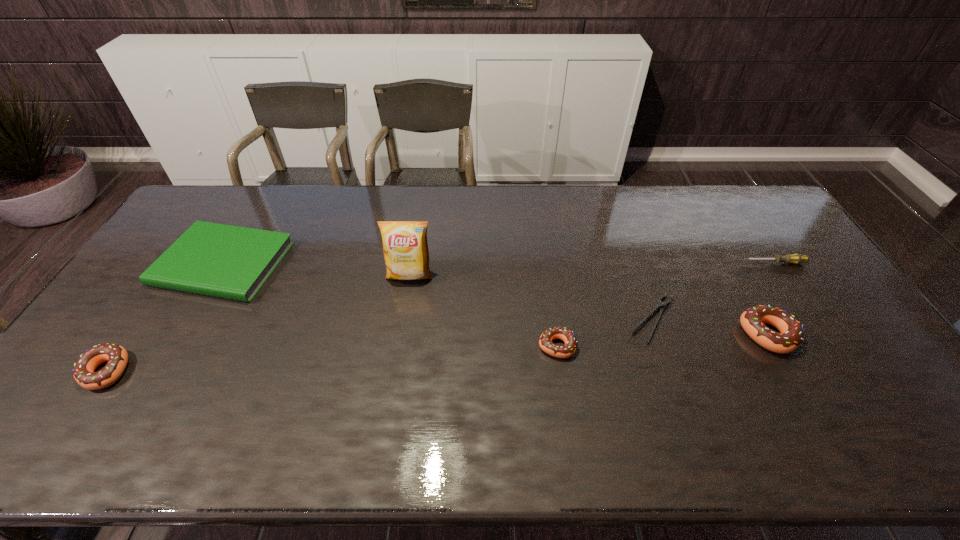
Locate an element on the screen. The height and width of the screenshot is (540, 960). vacant space located 0.240m on the front-facing side of the third object from left to right is located at coordinates (397, 353).

The image size is (960, 540). What are the coordinates of `object that is at the near edge` in the screenshot? It's located at pos(83,371).

Locate an element on the screen. Image resolution: width=960 pixels, height=540 pixels. doughnut that is positioned at the left edge is located at coordinates (83, 371).

This screenshot has width=960, height=540. I want to click on paperback book that is at the left edge, so click(x=231, y=262).

The image size is (960, 540). I want to click on object that is at the right edge, so click(x=796, y=258).

The image size is (960, 540). In order to click on object located in the near left corner section of the desktop in this screenshot , I will do `click(83, 371)`.

Locate an element on the screen. This screenshot has height=540, width=960. vacant space at the far edge of the desktop is located at coordinates (486, 216).

Where is `vacant space at the left edge of the desktop`? vacant space at the left edge of the desktop is located at coordinates (149, 315).

Identify the location of free point at the right edge. Image resolution: width=960 pixels, height=540 pixels. (819, 297).

In the image, there is a desktop. Identify the location of free space at the far left corner. (242, 187).